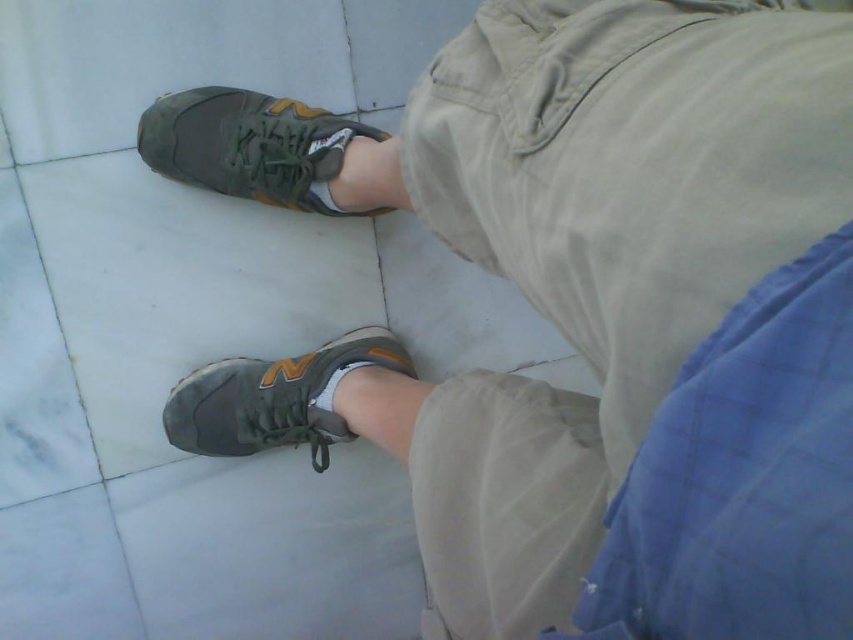
Is olive-green fabric shoe at center wider than matte gray shoe at lower center?

Correct, the width of olive-green fabric shoe at center exceeds that of matte gray shoe at lower center.

Is olive-green fabric shoe at center shorter than matte gray shoe at lower center?

No.

Where is `olive-green fabric shoe at center`? The width and height of the screenshot is (853, 640). olive-green fabric shoe at center is located at coordinates (250, 147).

Is point (260, 102) behind point (352, 348)?

No, it is in front of (352, 348).

From the picture: Between olive-green fabric shoe at center and matte gray running shoe at lower center, which one is positioned higher?

olive-green fabric shoe at center is above.

Is point (143, 150) closer to viewer compared to point (231, 403)?

That is True.

Identify the location of olive-green fabric shoe at center. (250, 147).

Is point (187, 432) farther from viewer compared to point (323, 401)?

Yes, it is behind point (323, 401).

Between matte gray running shoe at lower center and matte gray shoe at lower center, which one is positioned lower?

matte gray running shoe at lower center is below.

The width and height of the screenshot is (853, 640). Describe the element at coordinates (276, 397) in the screenshot. I see `matte gray running shoe at lower center` at that location.

This screenshot has width=853, height=640. In order to click on matte gray running shoe at lower center in this screenshot , I will do `click(276, 397)`.